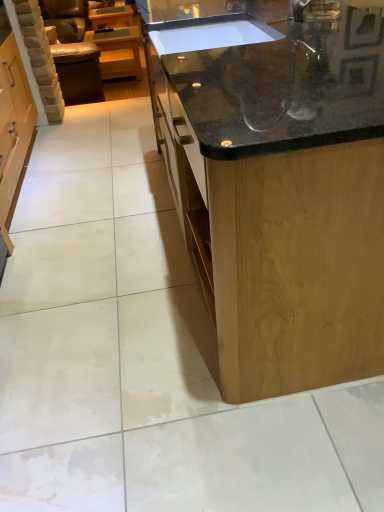
Question: From the image's perspective, is leather armchair at left above matte wood cabinet at upper left?

Choices:
 (A) no
 (B) yes

Answer: (A)

Question: From a real-world perspective, is leather armchair at left over matte wood cabinet at upper left?

Choices:
 (A) no
 (B) yes

Answer: (B)

Question: From a real-world perspective, is leather armchair at left positioned under matte wood cabinet at upper left based on gravity?

Choices:
 (A) yes
 (B) no

Answer: (B)

Question: Is leather armchair at left looking in the opposite direction of matte wood cabinet at upper left?

Choices:
 (A) no
 (B) yes

Answer: (A)

Question: Is leather armchair at left placed right next to matte wood cabinet at upper left?

Choices:
 (A) no
 (B) yes

Answer: (A)

Question: Would you say leather armchair at left is inside or outside black granite countertop at center, which appears as the 2th countertop when viewed from the front?

Choices:
 (A) inside
 (B) outside

Answer: (B)

Question: Based on their sizes in the image, would you say leather armchair at left is bigger or smaller than black granite countertop at center, acting as the first countertop starting from the back?

Choices:
 (A) small
 (B) big

Answer: (B)

Question: From a real-world perspective, is leather armchair at left above or below black granite countertop at center, acting as the first countertop starting from the back?

Choices:
 (A) above
 (B) below

Answer: (B)

Question: Considering the positions of leather armchair at left and black granite countertop at center, acting as the first countertop starting from the back, in the image, is leather armchair at left wider or thinner than black granite countertop at center, acting as the first countertop starting from the back,?

Choices:
 (A) wide
 (B) thin

Answer: (B)

Question: Considering the positions of leather armchair at left and matte wood cabinet at upper left in the image, is leather armchair at left wider or thinner than matte wood cabinet at upper left?

Choices:
 (A) thin
 (B) wide

Answer: (A)

Question: From a real-world perspective, is leather armchair at left positioned above or below matte wood cabinet at upper left?

Choices:
 (A) above
 (B) below

Answer: (A)

Question: Would you say leather armchair at left is to the left or to the right of matte wood cabinet at upper left in the picture?

Choices:
 (A) left
 (B) right

Answer: (A)

Question: From the image's perspective, is leather armchair at left located above or below matte wood cabinet at upper left?

Choices:
 (A) above
 (B) below

Answer: (B)

Question: In terms of size, does black granite countertop at center, marked as the 2th countertop in a back-to-front arrangement, appear bigger or smaller than black granite countertop at center, which appears as the 2th countertop when viewed from the front?

Choices:
 (A) big
 (B) small

Answer: (A)

Question: From a real-world perspective, is black granite countertop at center, marked as the 2th countertop in a back-to-front arrangement, physically located above or below black granite countertop at center, which appears as the 2th countertop when viewed from the front?

Choices:
 (A) above
 (B) below

Answer: (B)